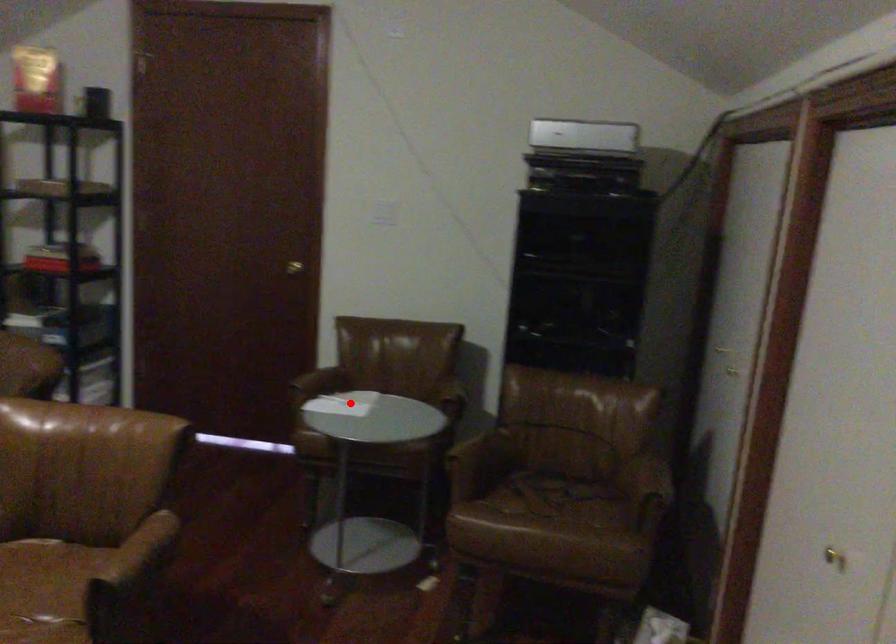
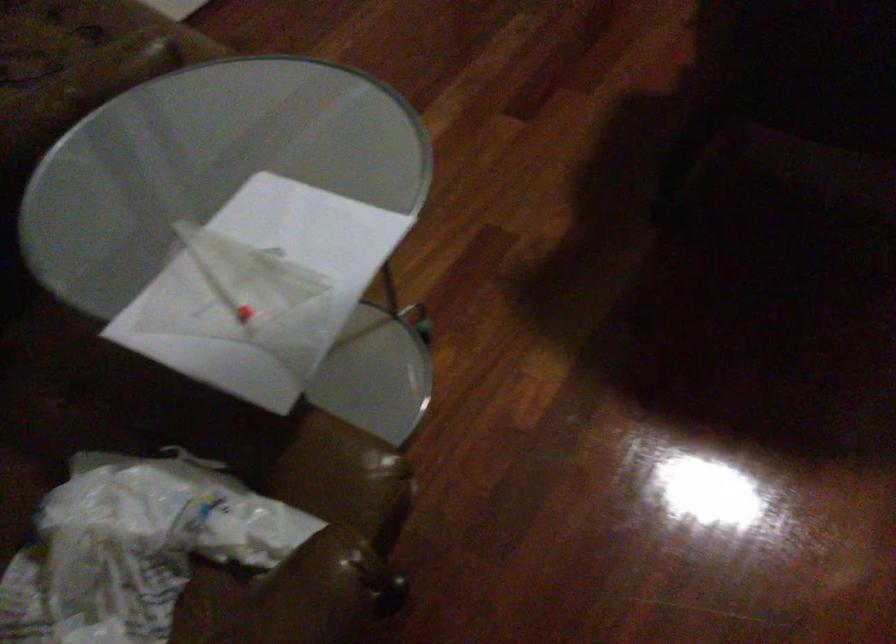
Question: I am providing you with two images of the same scene from different viewpoints. Image1 has a red point marked. In image2, the corresponding 3D location appears at what relative position? Reply with the corresponding letter.

Choices:
 (A) Closer
 (B) Farther

Answer: (A)